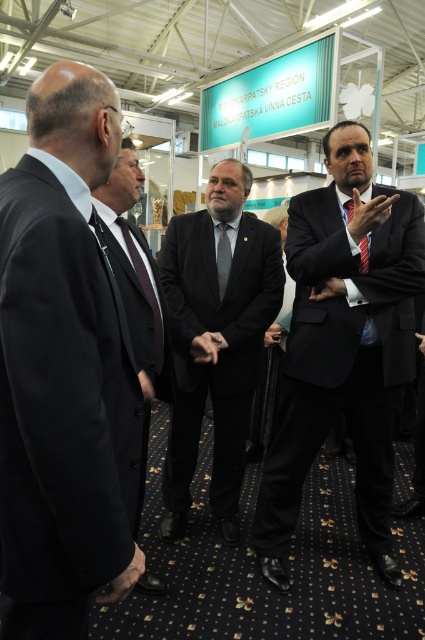
You are standing at point (129, 161) and want to walk to the nearest exit. The nearest exit is 1.83 meters away. Can you reach it without moving past the group of men?

Yes, you can reach the nearest exit without moving past the group of men since the distance between you and the exit is 1.83 meters, which is within a reasonable walking path.

You are attending a professional event and notice two men in the scene. One is wearing a black suit at left, and the other has a black silk tie at center. Based on their positions, which man is standing closer to the entrance of the room?

The black suit at left is to the left of the black silk tie at center, so the man in the black suit at left is closer to the entrance if the entrance is on the left side of the room.

You are a photographer taking a picture of the scene. You notice two points in the image at coordinates point (42, 424) and point (161, 365). Which point should you focus on to ensure the subject at that point is in sharp focus if you want the closest object to the camera to be clear?

You should focus on point (42, 424) because it is closer to the camera than point (161, 365), so focusing there will ensure the closest object is sharp.